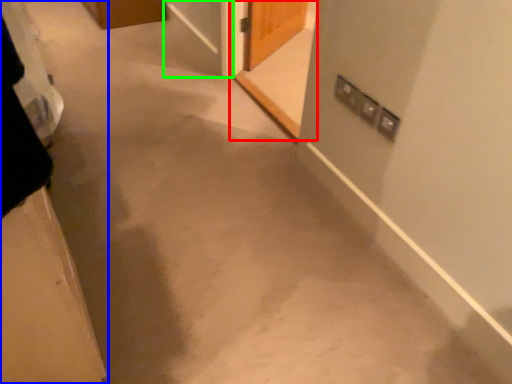
Question: Which is farther away from screen door (highlighted by a red box)? door (highlighted by a blue box) or screen door (highlighted by a green box)?

Choices:
 (A) door
 (B) screen door

Answer: (A)